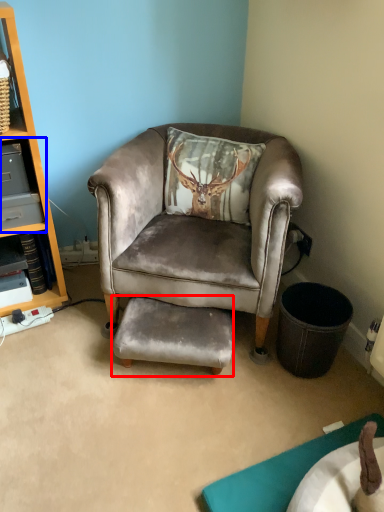
Question: Among these objects, which one is farthest to the camera, footrest (highlighted by a red box) or shelf (highlighted by a blue box)?

Choices:
 (A) footrest
 (B) shelf

Answer: (B)